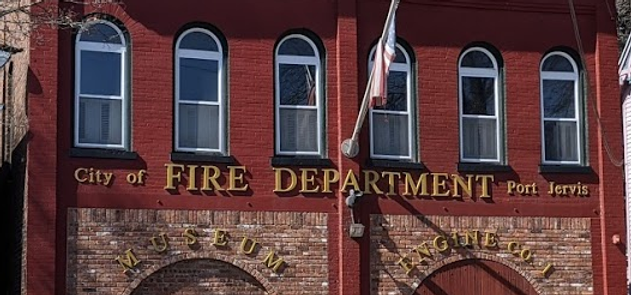
Identify the location of space in between window. (142, 101), (256, 111), (343, 95), (435, 110), (531, 118).